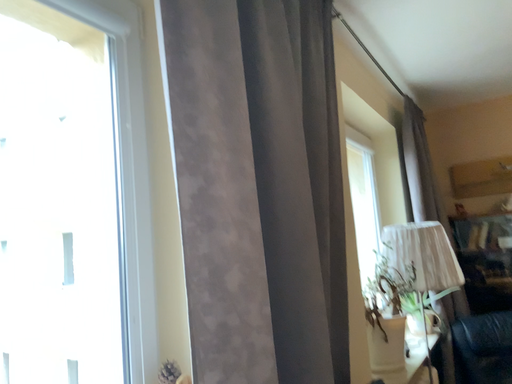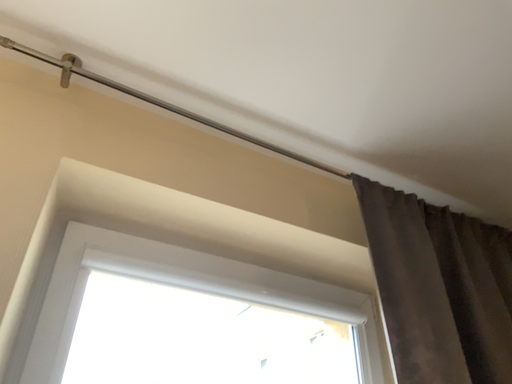
Question: Which way did the camera rotate in the video?

Choices:
 (A) rotated downward
 (B) rotated upward

Answer: (B)